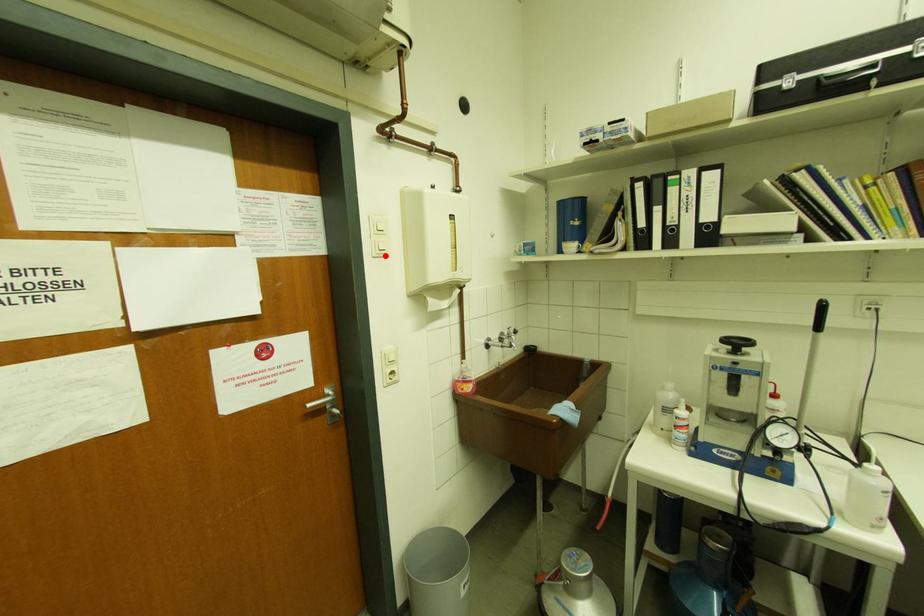
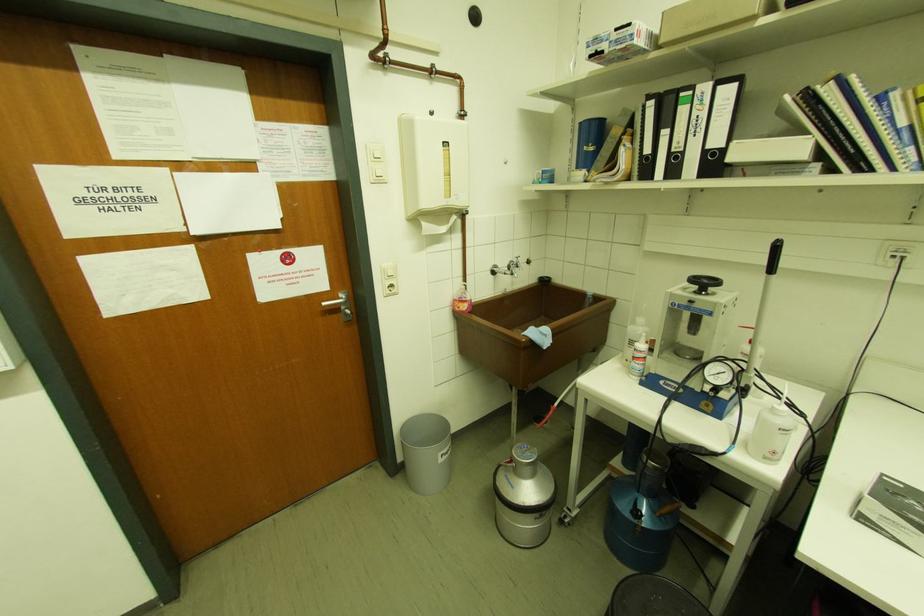
Where in the second image is the point corresponding to the highlighted location from the first image?

(383, 182)